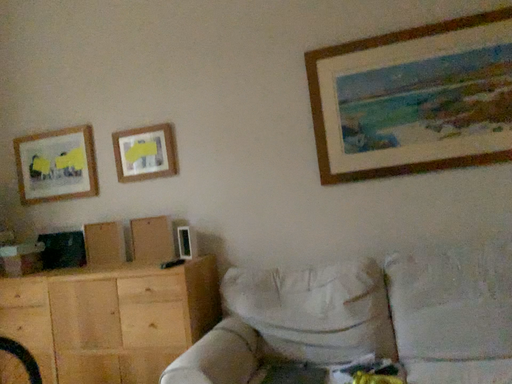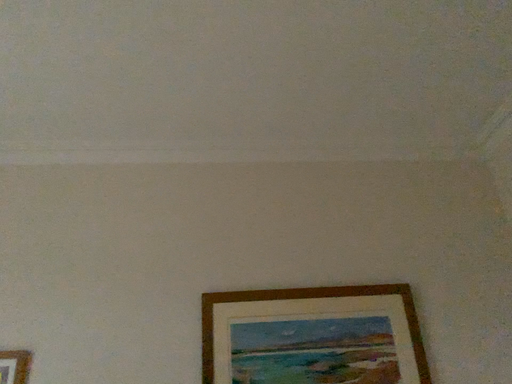
Question: Which way did the camera rotate in the video?

Choices:
 (A) rotated downward
 (B) rotated upward

Answer: (B)